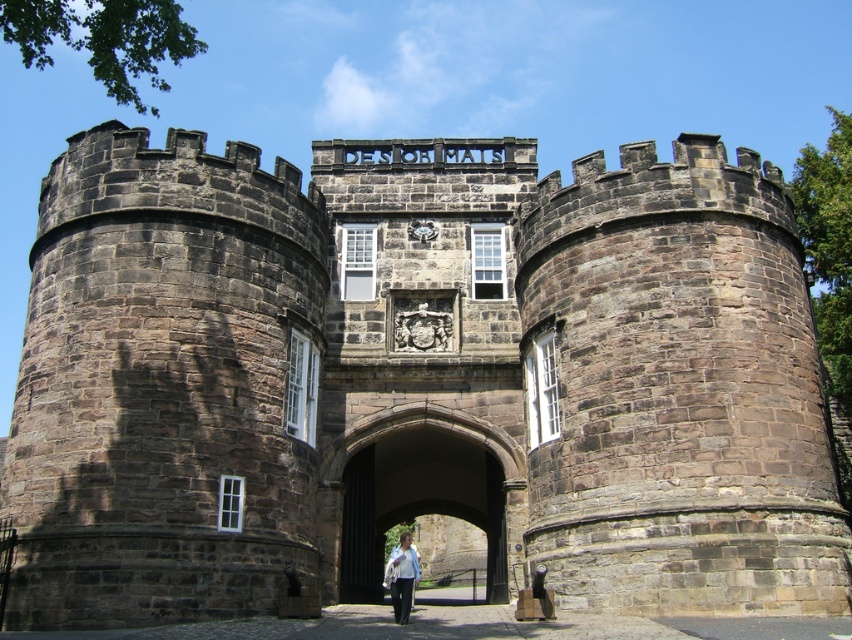
Is dark stone archway at center positioned behind white cotton shirt at center?

Yes, it is behind white cotton shirt at center.

Between dark stone archway at center and white cotton shirt at center, which one is positioned lower?

Positioned lower is white cotton shirt at center.

Is point (396, 433) closer to camera compared to point (406, 593)?

No.

I want to click on dark stone archway at center, so click(x=418, y=500).